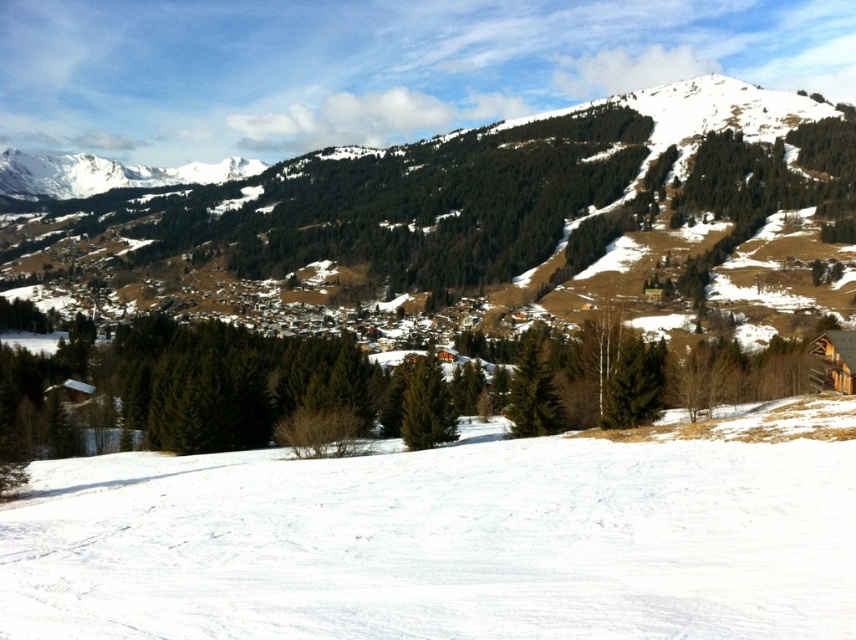
You are planning to build a small cabin on the white snow ski slope at lower center and the snowy forested mountain at center. Which location would allow the cabin to have a better view of the surrounding village?

The snowy forested mountain at center is taller than the white snow ski slope at lower center, so building the cabin there would provide a better view of the surrounding village.

You are standing at the point marked as point (449, 540). What is the terrain like under your feet?

The terrain under your feet is white snow ski slope at lower center.

You are a skier standing at the bottom of the white snow ski slope at lower center and want to reach the snowy forested mountain at center. Which direction should you head to get there?

The white snow ski slope at lower center is to the right of the snowy forested mountain at center, so you should head to the left to reach the snowy forested mountain at center.